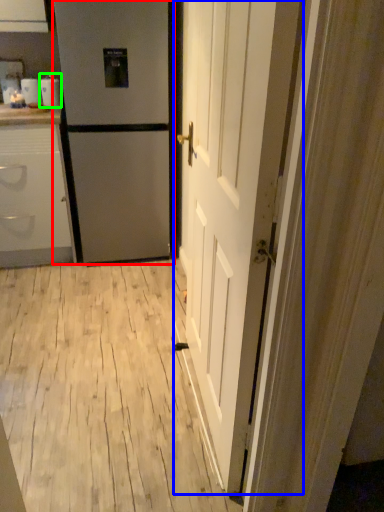
Question: Which object is positioned closest to refrigerator (highlighted by a red box)? Select from door (highlighted by a blue box) and appliance (highlighted by a green box).

Choices:
 (A) door
 (B) appliance

Answer: (B)